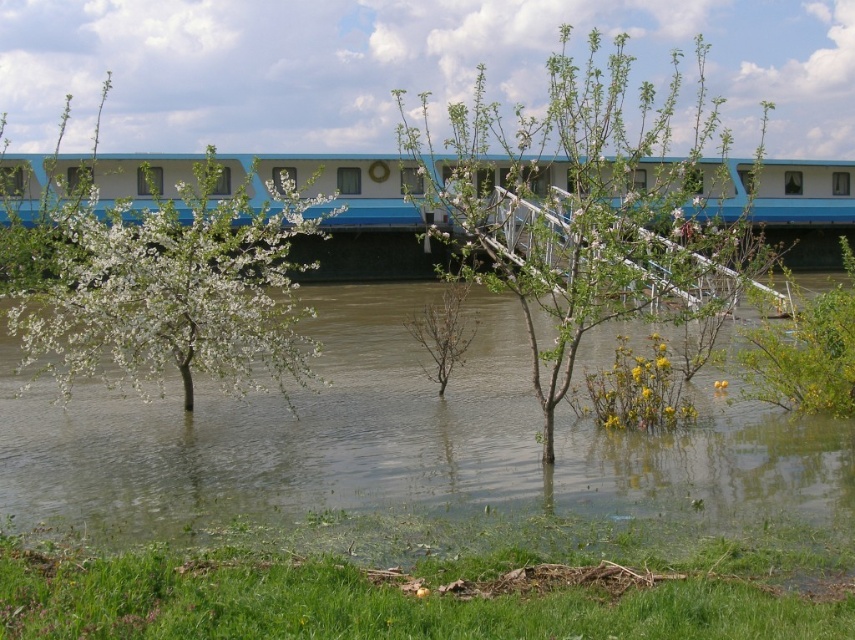
Which is below, white blossoming tree at center or yellow-green leafy bush at lower right?

yellow-green leafy bush at lower right is lower down.

Consider the image. Who is positioned more to the left, white blossoming tree at center or yellow-green leafy bush at lower right?

white blossoming tree at center

Find the location of `white blossoming tree at center`. white blossoming tree at center is located at coordinates (175, 291).

Between greenish-brown water at center and white blossoming tree at center, which one appears on the left side from the viewer's perspective?

white blossoming tree at center

Is point (699, 444) positioned before point (93, 294)?

No.

Who is more distant from viewer, (30, 436) or (223, 221)?

Point (30, 436)

I want to click on greenish-brown water at center, so click(405, 449).

Is point (675, 202) positioned in front of point (30, 202)?

That is True.

I want to click on green leafy tree at center, so click(585, 208).